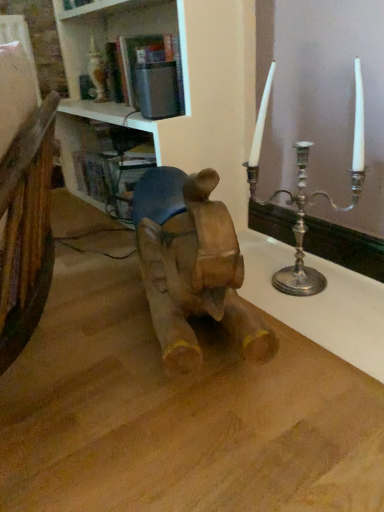
Where is `vacant space to the right of wooden horse at center`? Image resolution: width=384 pixels, height=512 pixels. vacant space to the right of wooden horse at center is located at coordinates (314, 324).